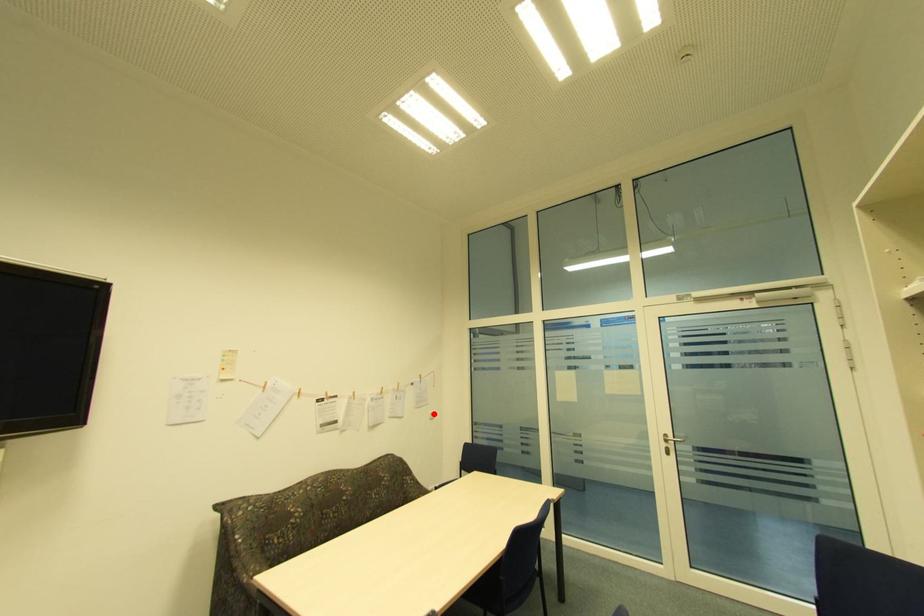
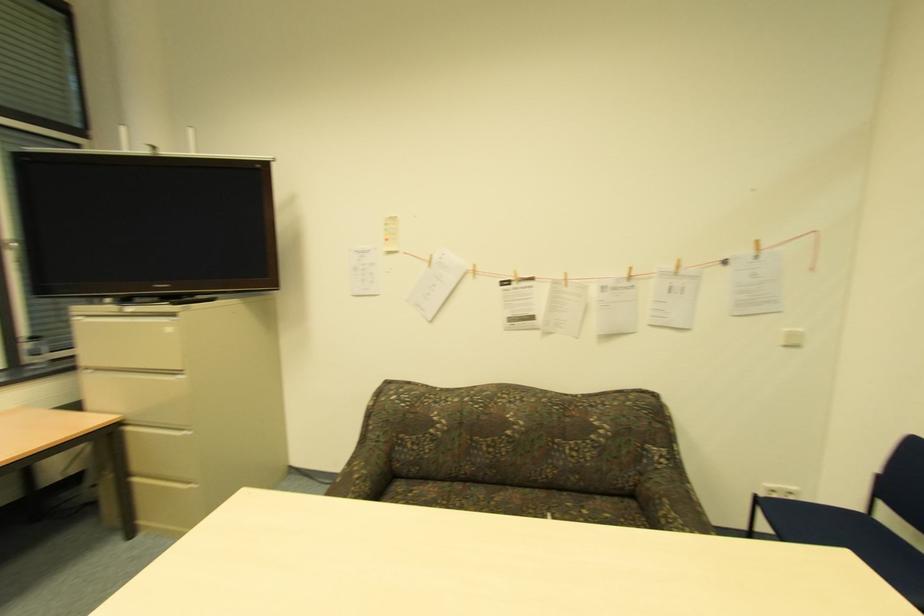
Locate, in the second image, the point that corresponds to the highlighted location in the first image.

(792, 334)